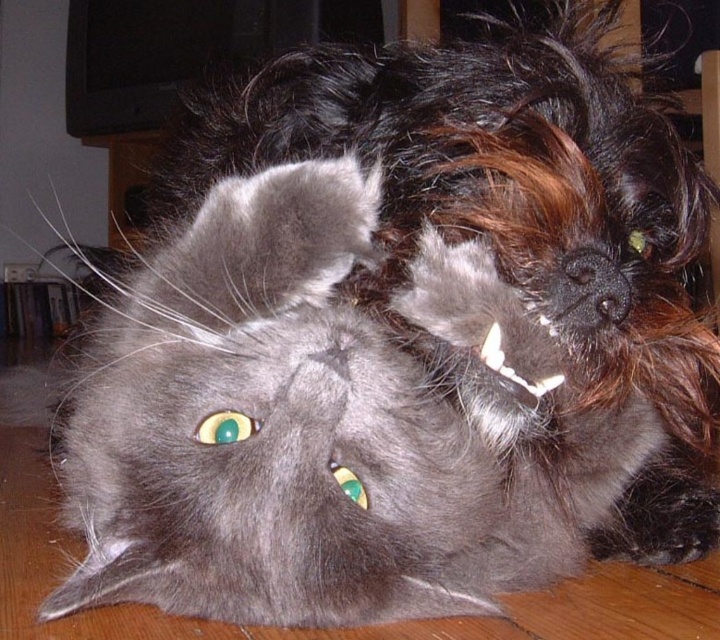
Question: Among these points, which one is farthest from the camera?

Choices:
 (A) (541, 195)
 (B) (613, 444)

Answer: (B)

Question: Which point is farther to the camera?

Choices:
 (A) (408, 305)
 (B) (600, 161)

Answer: (B)

Question: Is the position of soft gray fur cat at center more distant than that of shiny black fur at center?

Choices:
 (A) yes
 (B) no

Answer: (A)

Question: Is soft gray fur cat at center behind shiny black fur at center?

Choices:
 (A) yes
 (B) no

Answer: (A)

Question: Is soft gray fur cat at center smaller than shiny black fur at center?

Choices:
 (A) no
 (B) yes

Answer: (B)